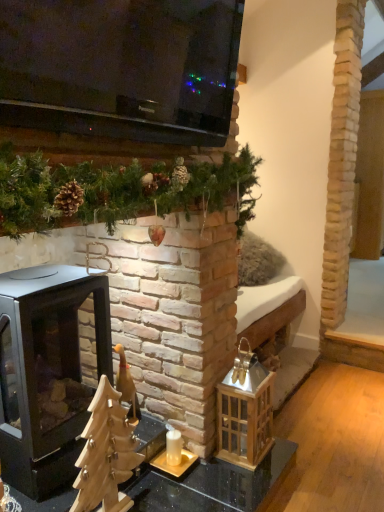
In order to click on free location to the right of gold metallic candle holder at center in this screenshot , I will do `click(212, 474)`.